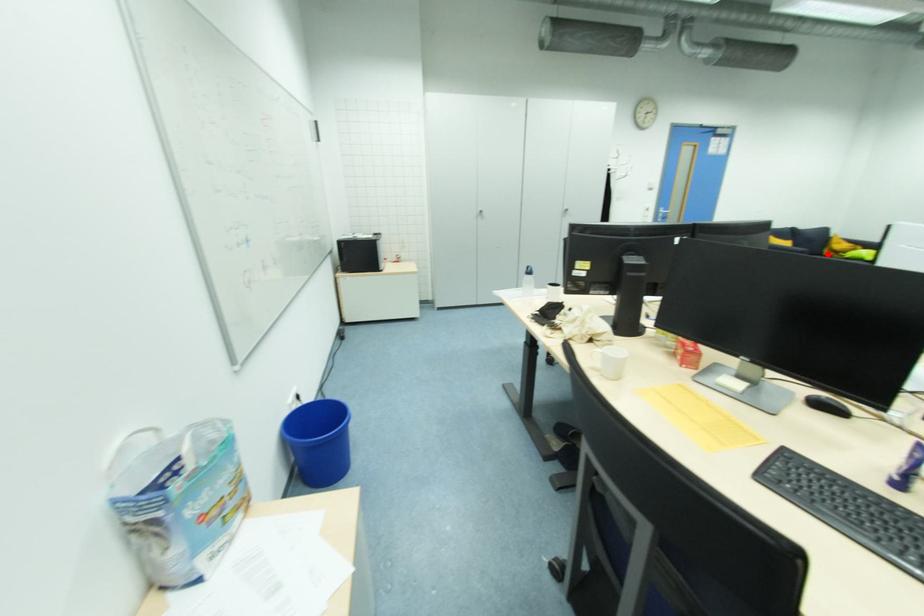
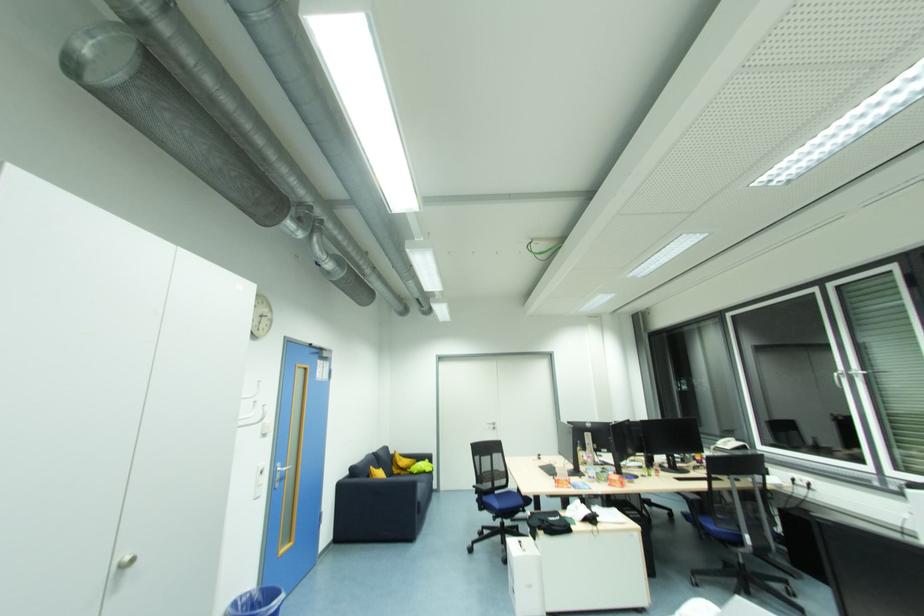
Question: I am providing you with two images of the same scene from different viewpoints. Image1 has a red point marked. In image2, the corresponding 3D location appears at what relative position? Reply with the corresponding letter.

Choices:
 (A) Closer
 (B) Farther

Answer: (A)